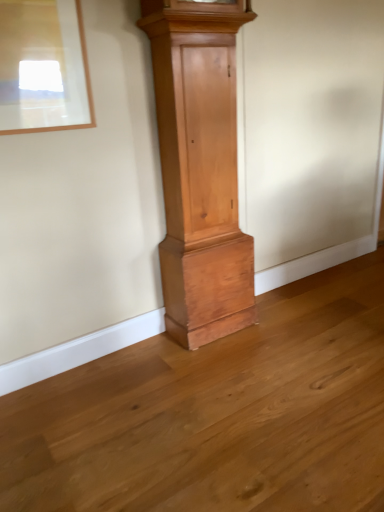
Identify the location of unoccupied region to the right of natural wood grandfather clock at center. The width and height of the screenshot is (384, 512). (286, 321).